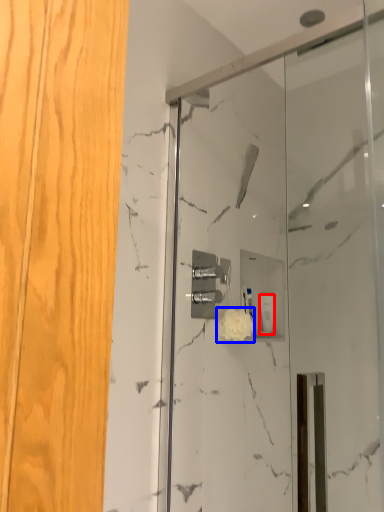
Question: Which object is further to the camera taking this photo, toiletry (highlighted by a red box) or flower (highlighted by a blue box)?

Choices:
 (A) toiletry
 (B) flower

Answer: (A)